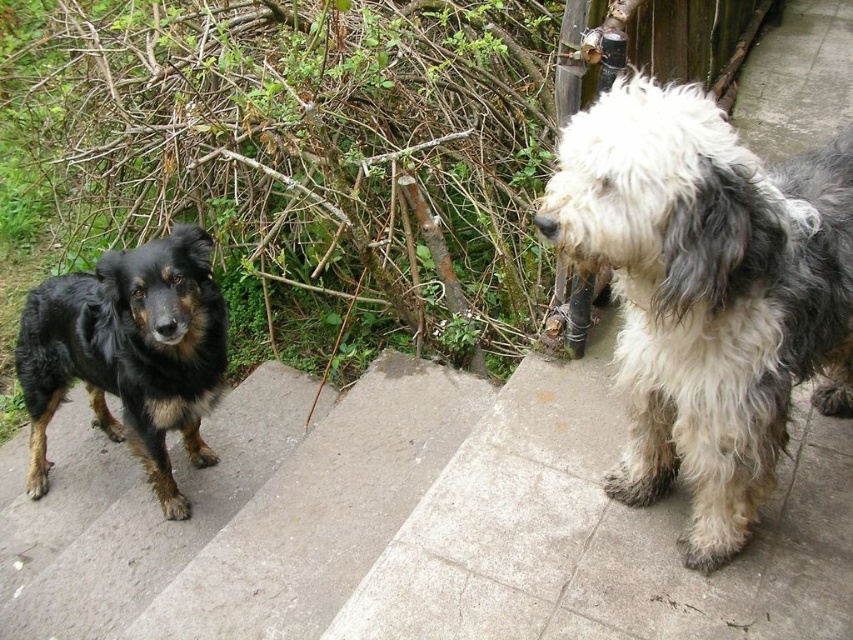
Question: Is white and gray fluffy dog at upper right smaller than shaggy black dog at left?

Choices:
 (A) yes
 (B) no

Answer: (A)

Question: Which object appears farthest from the camera in this image?

Choices:
 (A) white and gray fluffy dog at upper right
 (B) shaggy black dog at left
 (C) concrete stairs at lower left

Answer: (B)

Question: Which of the following is the farthest from the observer?

Choices:
 (A) concrete stairs at lower left
 (B) white and gray fluffy dog at upper right
 (C) shaggy black dog at left

Answer: (C)

Question: Which object is positioned farthest from the concrete stairs at lower left?

Choices:
 (A) white and gray fluffy dog at upper right
 (B) shaggy black dog at left

Answer: (A)

Question: Can you confirm if white and gray fluffy dog at upper right is smaller than concrete stairs at lower left?

Choices:
 (A) no
 (B) yes

Answer: (B)

Question: Is white and gray fluffy dog at upper right wider than shaggy black dog at left?

Choices:
 (A) no
 (B) yes

Answer: (B)